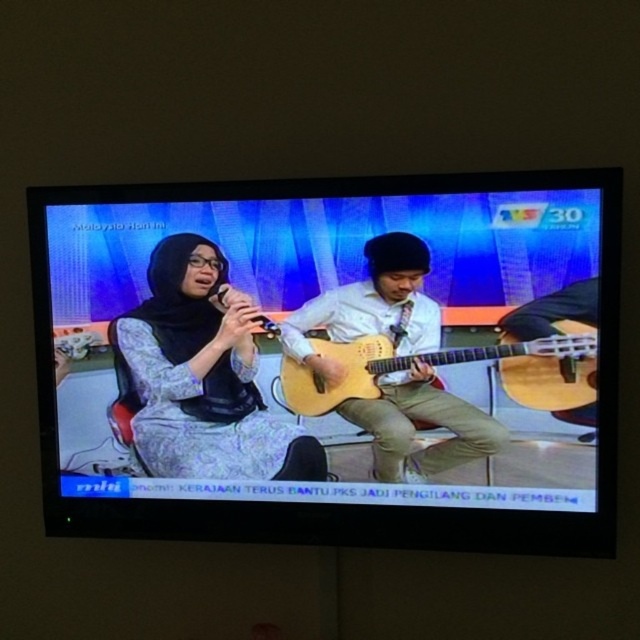
Question: Which of the following is the closest to the observer?

Choices:
 (A) (96, 273)
 (B) (314, 467)

Answer: (B)

Question: In this image, where is matte light brown guitar at center located relative to light wood acoustic guitar at center?

Choices:
 (A) right
 (B) left

Answer: (B)

Question: Estimate the real-world distances between objects in this image. Which object is closer to the patterned fabric hijab at center?

Choices:
 (A) matte wood guitar at center
 (B) matte light brown guitar at center
 (C) light wood acoustic guitar at center

Answer: (A)

Question: Does matte light brown guitar at center have a greater width compared to light wood acoustic guitar at center?

Choices:
 (A) yes
 (B) no

Answer: (B)

Question: Considering the relative positions of matte wood guitar at center and matte light brown guitar at center in the image provided, where is matte wood guitar at center located with respect to matte light brown guitar at center?

Choices:
 (A) above
 (B) below

Answer: (B)

Question: Which point is closer to the camera?

Choices:
 (A) light wood acoustic guitar at center
 (B) matte light brown guitar at center
 (C) patterned fabric hijab at center
 (D) matte wood guitar at center

Answer: (D)